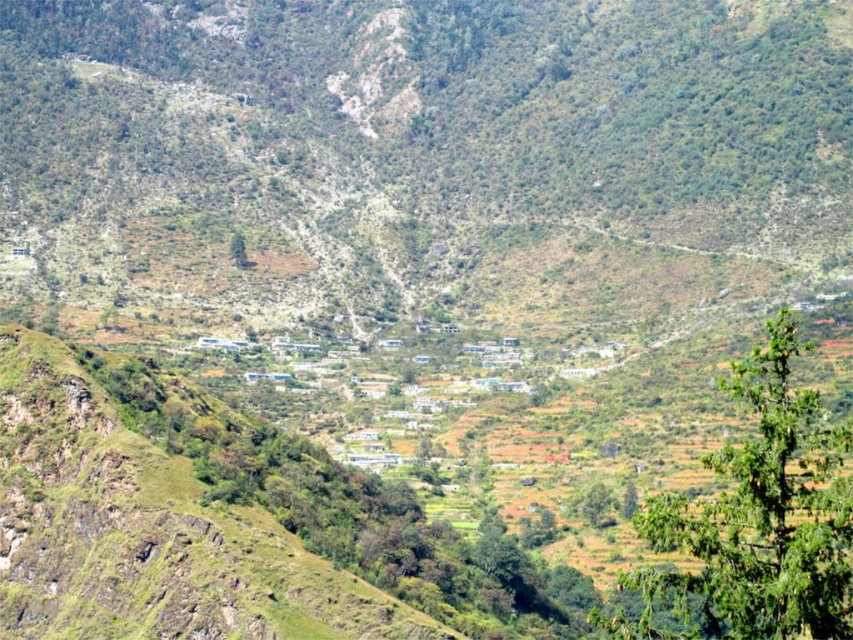
Between green leafy tree at right and green leafy tree at center, which one is positioned higher?

Positioned higher is green leafy tree at center.

From the picture: Is green leafy tree at right bigger than green leafy tree at center?

Yes.

Which is in front, point (830, 602) or point (231, 257)?

Point (830, 602)

The width and height of the screenshot is (853, 640). What are the coordinates of `green leafy tree at right` in the screenshot? It's located at (757, 520).